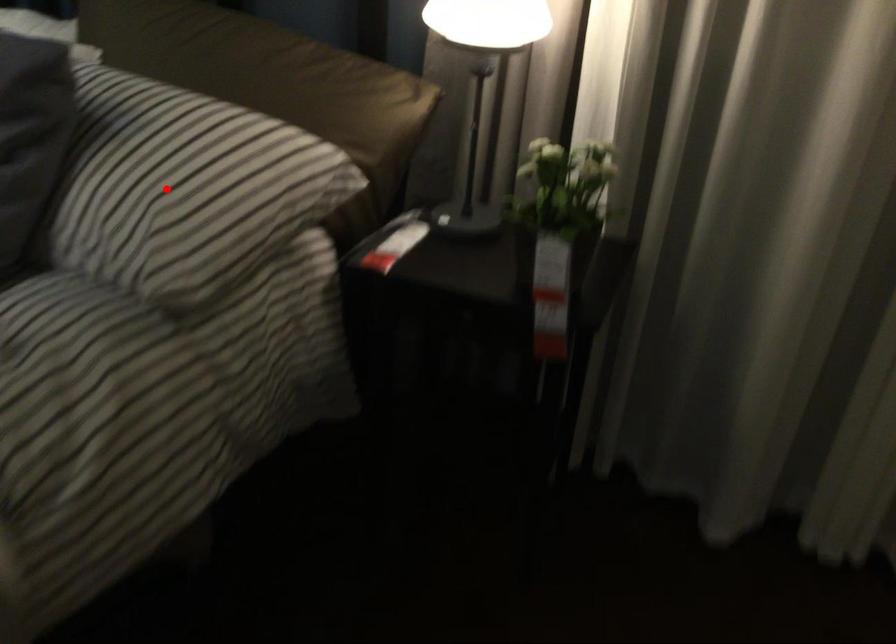
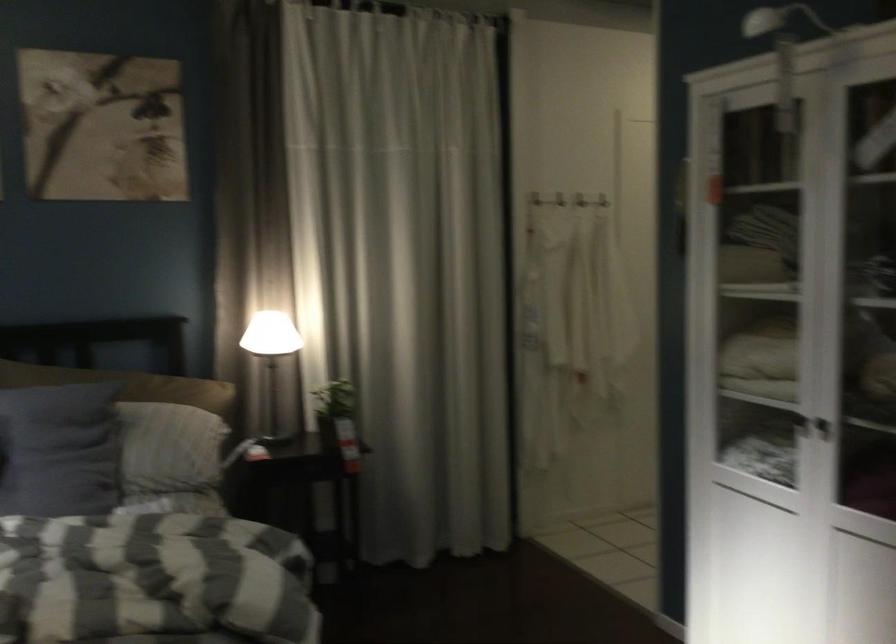
Question: I am providing you with two images of the same scene from different viewpoints. Image1 has a red point marked. In image2, the corresponding 3D location appears at what relative position? Reply with the corresponding letter.

Choices:
 (A) Closer
 (B) Farther

Answer: (B)